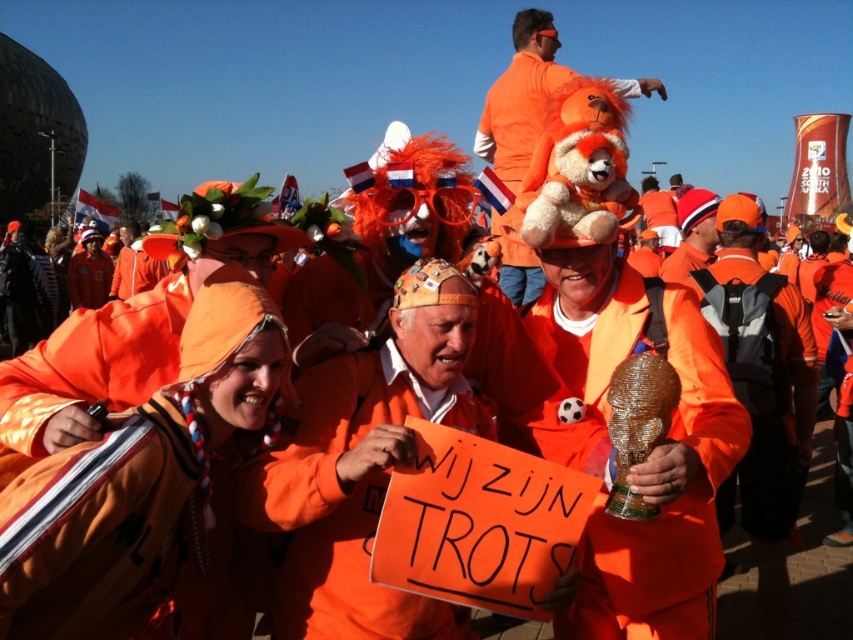
Does orange fabric backpack at center-right have a greater height compared to fluffy orange bear at center?

No.

Where is `orange fabric backpack at center-right`? This screenshot has width=853, height=640. orange fabric backpack at center-right is located at coordinates (761, 387).

Between point (791, 308) and point (531, 291), which one is positioned behind?

Positioned behind is point (531, 291).

Find the location of a particular element. The width and height of the screenshot is (853, 640). orange fabric backpack at center-right is located at coordinates (761, 387).

Can you confirm if orange matte sign at center is positioned to the right of orange fabric backpack at center-right?

In fact, orange matte sign at center is to the left of orange fabric backpack at center-right.

Can you confirm if orange matte sign at center is bigger than orange fabric backpack at center-right?

No, orange matte sign at center is not bigger than orange fabric backpack at center-right.

You are a GUI agent. You are given a task and a screenshot of the screen. Output one action in this format:
    pyautogui.click(x=<x>, y=<y>)
    Task: Click on the orange matte sign at center
    
    Given the screenshot: What is the action you would take?
    pyautogui.click(x=345, y=502)

Does matte orange jacket at center have a lesser width compared to fluffy orange bear at center?

Yes.

Does point (579, 384) come behind point (509, 109)?

No, (579, 384) is in front of (509, 109).

Identify the location of matte orange jacket at center. This screenshot has height=640, width=853. (651, 452).